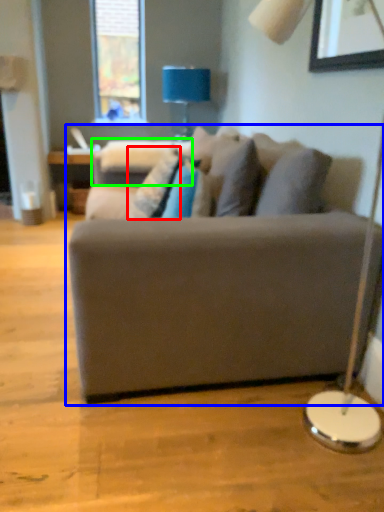
Question: Which is farther away from pillow (highlighted by a red box)? studio couch (highlighted by a blue box) or swivel chair (highlighted by a green box)?

Choices:
 (A) studio couch
 (B) swivel chair

Answer: (A)